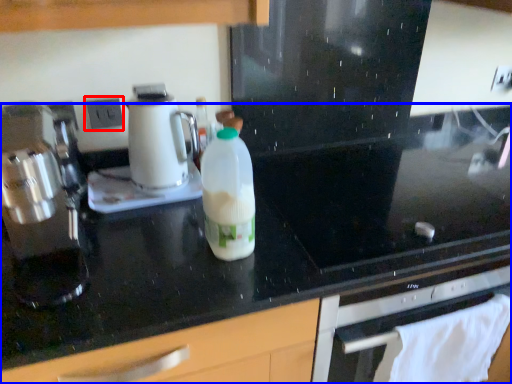
Question: Among these objects, which one is farthest to the camera, electric outlet (highlighted by a red box) or countertop (highlighted by a blue box)?

Choices:
 (A) electric outlet
 (B) countertop

Answer: (A)